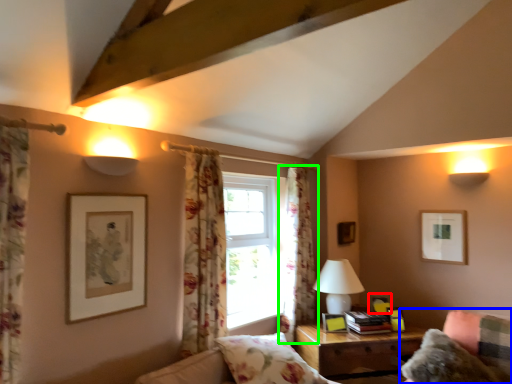
Question: Which is nearer to the picture frame (highlighted by a red box)? couch (highlighted by a blue box) or curtain (highlighted by a green box).

Choices:
 (A) couch
 (B) curtain

Answer: (A)